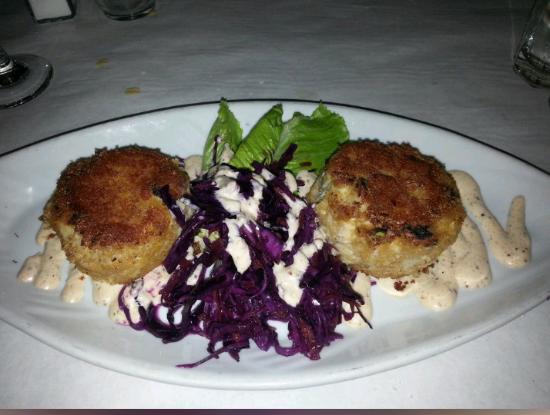
This screenshot has width=550, height=415. Identify the location of plate. (378, 125).